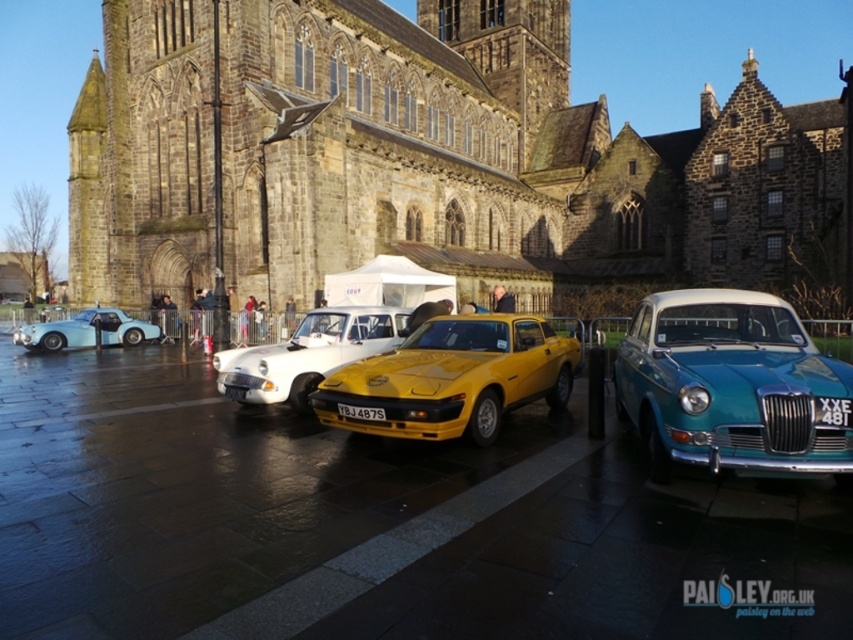
Can you confirm if yellow matte sports car at center is positioned to the right of yellow matte license plate at center?

No, yellow matte sports car at center is not to the right of yellow matte license plate at center.

Who is taller, yellow matte sports car at center or yellow matte license plate at center?

yellow matte sports car at center

You are a GUI agent. You are given a task and a screenshot of the screen. Output one action in this format:
    pyautogui.click(x=<x>, y=<y>)
    Task: Click on the yellow matte sports car at center
    The image size is (853, 640).
    Given the screenshot: What is the action you would take?
    pyautogui.click(x=308, y=353)

The width and height of the screenshot is (853, 640). I want to click on yellow matte sports car at center, so click(x=308, y=353).

Is teal metallic sedan at right to the left of yellow matte car at center from the viewer's perspective?

Incorrect, teal metallic sedan at right is not on the left side of yellow matte car at center.

Between teal metallic sedan at right and yellow matte car at center, which one has more height?

teal metallic sedan at right

Where is `teal metallic sedan at right`? teal metallic sedan at right is located at coordinates (732, 387).

You are a GUI agent. You are given a task and a screenshot of the screen. Output one action in this format:
    pyautogui.click(x=<x>, y=<y>)
    Task: Click on the teal metallic sedan at right
    This screenshot has width=853, height=640.
    Given the screenshot: What is the action you would take?
    point(732,387)

Can you confirm if matte blue car at left is taller than yellow matte license plate at center?

Yes, matte blue car at left is taller than yellow matte license plate at center.

Who is shorter, matte blue car at left or yellow matte license plate at center?

Standing shorter between the two is yellow matte license plate at center.

Does point (111, 330) lie in front of point (360, 413)?

No, (111, 330) is further to viewer.

Locate an element on the screen. Image resolution: width=853 pixels, height=640 pixels. matte blue car at left is located at coordinates (86, 330).